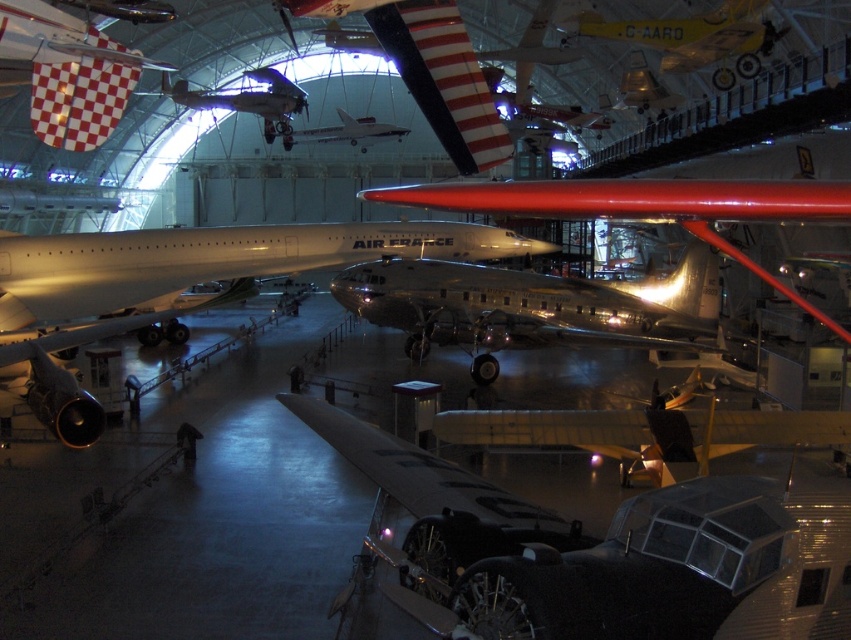
You are an aviation enthusiast visiting the museum and want to take a photo of both the shiny silver airplane at lower right and the yellow polished wood airplane at upper center in the same frame. Considering their heights, which airplane will appear smaller in your photo?

The shiny silver airplane at lower right has a lesser height compared to the yellow polished wood airplane at upper center, so it will appear smaller in the photo.

You are a museum guide explaining the aircraft displays. You mention both the polished silver airplane at center and the metallic silver airplane at center. Which one is shorter in height?

The polished silver airplane at center is shorter in height than the metallic silver airplane at center.

You are standing at the entrance of the aviation museum and want to take a photo of the shiny silver airplane at lower right. If you face the entrance, which direction should you turn to locate it?

The shiny silver airplane at lower right is located at point (601,554), which is to your right side when facing the entrance. Therefore, you should turn to your right to locate it.